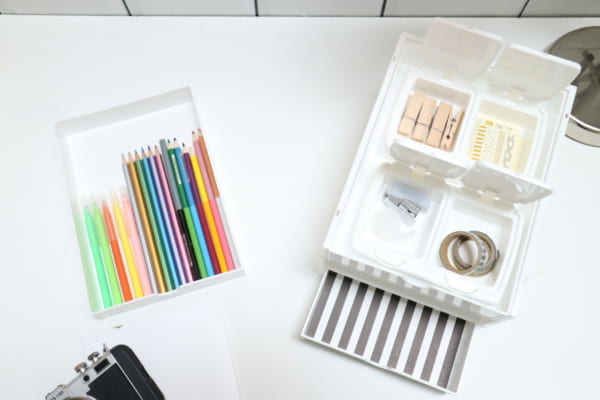
You are a GUI agent. You are given a task and a screenshot of the screen. Output one action in this format:
    pyautogui.click(x=<x>, y=<y>)
    Task: Click on the markers
    
    Given the screenshot: What is the action you would take?
    pyautogui.click(x=84, y=255), pyautogui.click(x=96, y=255), pyautogui.click(x=106, y=255), pyautogui.click(x=117, y=255), pyautogui.click(x=127, y=252), pyautogui.click(x=137, y=250)